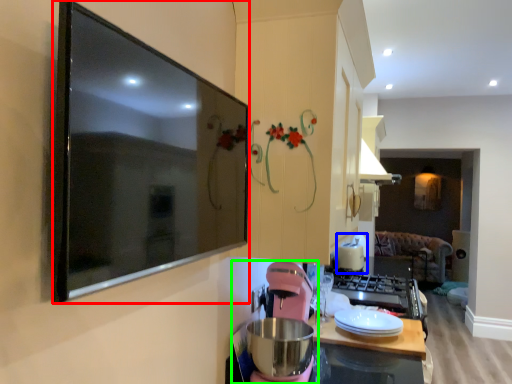
Question: Considering the real-world distances, which object is farthest from picture frame (highlighted by a red box)? appliance (highlighted by a blue box) or blender (highlighted by a green box)?

Choices:
 (A) appliance
 (B) blender

Answer: (A)